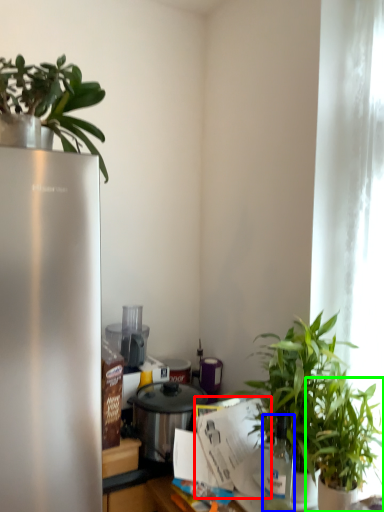
Question: Which object is positioned farthest from paper (highlighted by a red box)? Select from bottle (highlighted by a blue box) and houseplant (highlighted by a green box).

Choices:
 (A) bottle
 (B) houseplant

Answer: (B)